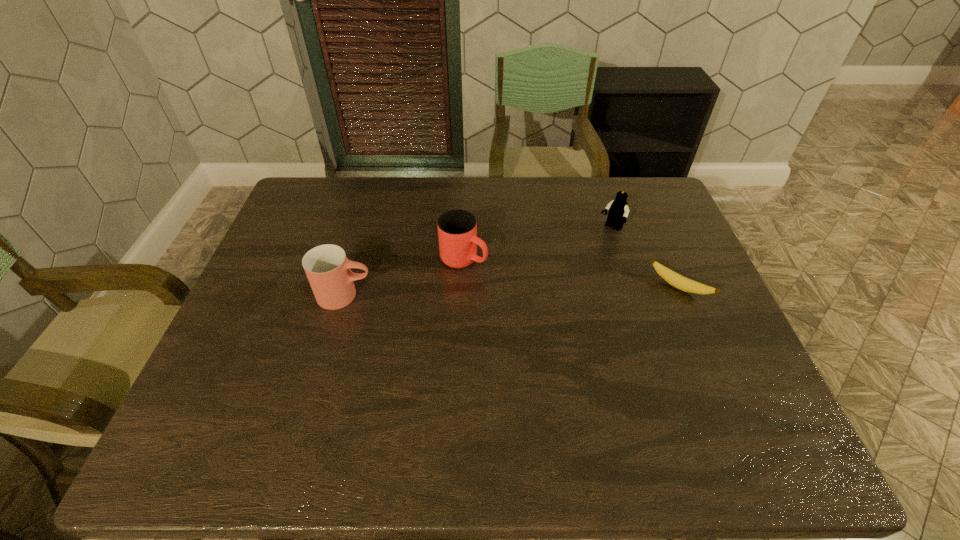
This screenshot has width=960, height=540. Identify the location of vacant point located on the handle side of the farther cup. (513, 282).

This screenshot has width=960, height=540. What are the coordinates of `free space located 0.350m on the handle side of the farther cup` in the screenshot? It's located at (597, 323).

Locate an element on the screen. The width and height of the screenshot is (960, 540). vacant space situated on the handle side of the farther cup is located at coordinates (593, 322).

This screenshot has width=960, height=540. I want to click on free space located 0.200m on the front-facing side of the Lego, so click(x=571, y=270).

This screenshot has width=960, height=540. I want to click on free location located on the front-facing side of the Lego, so click(588, 253).

Identify the location of vacant area situated 0.350m on the front-facing side of the Lego. (x=541, y=301).

This screenshot has height=540, width=960. I want to click on object that is at the right edge, so click(x=685, y=284).

In the image, there is a desktop. Identify the location of vacant space at the far edge. The height and width of the screenshot is (540, 960). (414, 209).

Identify the location of vacant space at the near edge. (561, 409).

In the image, there is a desktop. Identify the location of vacant space at the left edge. (295, 245).